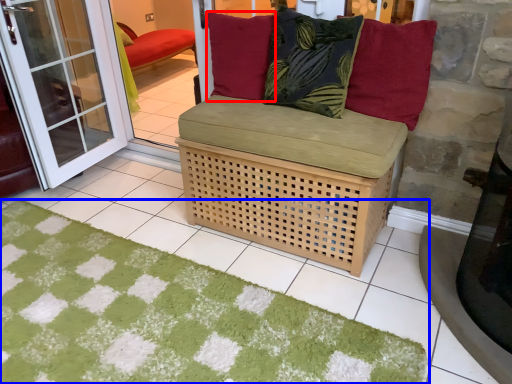
Question: Which object appears farthest to the camera in this image, pillow (highlighted by a red box) or doormat (highlighted by a blue box)?

Choices:
 (A) pillow
 (B) doormat

Answer: (A)